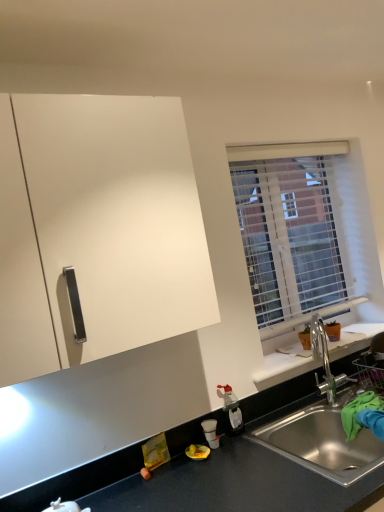
What is the approximate height of white matte cabinet at upper left?

white matte cabinet at upper left is 29.70 inches in height.

Where is `white matte cabinet at upper left`? The width and height of the screenshot is (384, 512). white matte cabinet at upper left is located at coordinates (105, 231).

The width and height of the screenshot is (384, 512). I want to click on matte black countertop at lower center, so click(76, 480).

Locate an element on the screen. stainless steel sink at lower right is located at coordinates (323, 441).

From the image's perspective, is matte black countertop at lower center located above or below translucent plastic bottle at lower center?

From the image's perspective, matte black countertop at lower center appears below translucent plastic bottle at lower center.

From the picture: Is translucent plastic bottle at lower center inside matte black countertop at lower center?

No.

Considering the positions of point (124, 476) and point (234, 400), is point (124, 476) closer or farther from the camera than point (234, 400)?

Point (124, 476) is closer to the camera than point (234, 400).

Does matte black countertop at lower center touch translucent plastic bottle at lower center?

They are not placed beside each other.

Is point (265, 284) closer or farther from the camera than point (229, 395)?

Point (265, 284).

Can you confirm if white translucent blinds at upper right is shorter than translucent plastic bottle at lower center?

Incorrect, the height of white translucent blinds at upper right does not fall short of that of translucent plastic bottle at lower center.

Are white translucent blinds at upper right and translucent plastic bottle at lower center beside each other?

No.

Is white translucent blinds at upper right spatially inside stainless steel sink at lower right, or outside of it?

white translucent blinds at upper right is located beyond the bounds of stainless steel sink at lower right.

Looking at their sizes, would you say white translucent blinds at upper right is wider or thinner than stainless steel sink at lower right?

Considering their sizes, white translucent blinds at upper right looks slimmer than stainless steel sink at lower right.

Which of these two, white translucent blinds at upper right or stainless steel sink at lower right, stands taller?

white translucent blinds at upper right is taller.

From the image's perspective, who appears lower, white translucent blinds at upper right or stainless steel sink at lower right?

From the image's view, stainless steel sink at lower right is below.

Based on the photo, is white translucent blinds at upper right positioned in front of white matte cabinet at upper left?

No.

Considering the relative sizes of white translucent blinds at upper right and white matte cabinet at upper left in the image provided, is white translucent blinds at upper right shorter than white matte cabinet at upper left?

No, white translucent blinds at upper right is not shorter than white matte cabinet at upper left.

Is white matte cabinet at upper left at the back of white translucent blinds at upper right?

No, white translucent blinds at upper right's orientation is not away from white matte cabinet at upper left.

Is white matte cabinet at upper left surrounded by white translucent blinds at upper right?

No, white matte cabinet at upper left is not a part of white translucent blinds at upper right.

Would you say white matte cabinet at upper left is outside white translucent blinds at upper right?

That's correct, white matte cabinet at upper left is outside of white translucent blinds at upper right.

Between white matte cabinet at upper left and white translucent blinds at upper right, which one has smaller width?

white translucent blinds at upper right.

From a real-world perspective, between white matte cabinet at upper left and white translucent blinds at upper right, who is vertically lower?

white translucent blinds at upper right.

The width and height of the screenshot is (384, 512). In order to click on window located behind the white matte cabinet at upper left in this screenshot , I will do `click(290, 232)`.

From the image's perspective, between translucent plastic bottle at lower center and matte black countertop at lower center, who is located below?

matte black countertop at lower center is shown below in the image.

Which of these two, translucent plastic bottle at lower center or matte black countertop at lower center, is wider?

With larger width is translucent plastic bottle at lower center.

Is translucent plastic bottle at lower center beside matte black countertop at lower center?

No, translucent plastic bottle at lower center is not beside matte black countertop at lower center.

Considering the sizes of stainless steel sink at lower right and white translucent blinds at upper right in the image, is stainless steel sink at lower right taller or shorter than white translucent blinds at upper right?

In the image, stainless steel sink at lower right appears to be shorter than white translucent blinds at upper right.

Where is `window positioned vertically above the stainless steel sink at lower right (from a real-world perspective)`? window positioned vertically above the stainless steel sink at lower right (from a real-world perspective) is located at coordinates (290, 232).

From the image's perspective, relative to white translucent blinds at upper right, is stainless steel sink at lower right above or below?

Based on their image positions, stainless steel sink at lower right is located beneath white translucent blinds at upper right.

Is stainless steel sink at lower right oriented away from white translucent blinds at upper right?

stainless steel sink at lower right does not have its back to white translucent blinds at upper right.

What are the coordinates of `bottle above the matte black countertop at lower center (from a real-world perspective)` in the screenshot? It's located at (231, 410).

Locate an element on the screen. The width and height of the screenshot is (384, 512). bottle on the left side of white translucent blinds at upper right is located at coordinates (231, 410).

Estimate the real-world distances between objects in this image. Which object is further from stainless steel sink at lower right, matte black countertop at lower center or white translucent blinds at upper right?

white translucent blinds at upper right.

Estimate the real-world distances between objects in this image. Which object is further from matte black countertop at lower center, stainless steel sink at lower right or white translucent blinds at upper right?

The object further to matte black countertop at lower center is white translucent blinds at upper right.

Based on their spatial positions, is white translucent blinds at upper right or translucent plastic bottle at lower center closer to stainless steel sink at lower right?

translucent plastic bottle at lower center lies closer to stainless steel sink at lower right than the other object.

Looking at the image, which one is located further to translucent plastic bottle at lower center, stainless steel sink at lower right or white translucent blinds at upper right?

white translucent blinds at upper right.

Estimate the real-world distances between objects in this image. Which object is closer to matte black countertop at lower center, white translucent blinds at upper right or white matte cabinet at upper left?

Among the two, white matte cabinet at upper left is located nearer to matte black countertop at lower center.

Based on the photo, based on their spatial positions, is translucent plastic bottle at lower center or stainless steel sink at lower right further from white matte cabinet at upper left?

Among the two, stainless steel sink at lower right is located further to white matte cabinet at upper left.

Looking at the image, which one is located further to white matte cabinet at upper left, matte black countertop at lower center or translucent plastic bottle at lower center?

Based on the image, translucent plastic bottle at lower center appears to be further to white matte cabinet at upper left.

In the scene shown: Looking at the image, which one is located closer to white matte cabinet at upper left, matte black countertop at lower center or stainless steel sink at lower right?

matte black countertop at lower center lies closer to white matte cabinet at upper left than the other object.

Image resolution: width=384 pixels, height=512 pixels. In order to click on window located between white matte cabinet at upper left and stainless steel sink at lower right in the left-right direction in this screenshot , I will do `click(290, 232)`.

Identify the location of bottle between white matte cabinet at upper left and matte black countertop at lower center in the up-down direction. (231, 410).

This screenshot has width=384, height=512. Find the location of `bottle between white matte cabinet at upper left and stainless steel sink at lower right`. bottle between white matte cabinet at upper left and stainless steel sink at lower right is located at coordinates (231, 410).

Where is `countertop located between translucent plastic bottle at lower center and stainless steel sink at lower right in the left-right direction`? This screenshot has width=384, height=512. countertop located between translucent plastic bottle at lower center and stainless steel sink at lower right in the left-right direction is located at coordinates (76, 480).